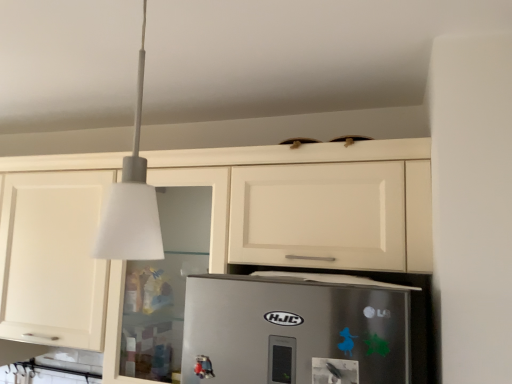
Describe the element at coordinates (131, 200) in the screenshot. The height and width of the screenshot is (384, 512). I see `white matte lampshade at upper center` at that location.

Where is `white matte lampshade at upper center`? This screenshot has width=512, height=384. white matte lampshade at upper center is located at coordinates (131, 200).

Describe the element at coordinates (300, 163) in the screenshot. I see `white matte cabinet at upper center` at that location.

The width and height of the screenshot is (512, 384). Identify the location of white matte cabinet at upper center. (300, 163).

Locate an element on the screen. The image size is (512, 384). white matte lampshade at upper center is located at coordinates (131, 200).

Is white matte lampshade at upper center to the left or to the right of white matte cabinet at upper center in the image?

In the image, white matte lampshade at upper center appears on the right side of white matte cabinet at upper center.

Which is in front, white matte lampshade at upper center or white matte cabinet at upper center?

Positioned in front is white matte lampshade at upper center.

Between point (126, 166) and point (429, 237), which one is positioned in front?

The point (126, 166) is closer.

From the image's perspective, is white matte lampshade at upper center on white matte cabinet at upper center?

Yes, from the image's perspective, white matte lampshade at upper center is over white matte cabinet at upper center.

From a real-world perspective, between white matte lampshade at upper center and white matte cabinet at upper center, who is vertically lower?

white matte cabinet at upper center is physically lower.

Which of these two, white matte lampshade at upper center or white matte cabinet at upper center, is wider?

With larger width is white matte cabinet at upper center.

Considering the relative sizes of white matte lampshade at upper center and white matte cabinet at upper center in the image provided, is white matte lampshade at upper center taller than white matte cabinet at upper center?

Incorrect, the height of white matte lampshade at upper center is not larger of that of white matte cabinet at upper center.

Can you confirm if white matte lampshade at upper center is smaller than white matte cabinet at upper center?

Correct, white matte lampshade at upper center occupies less space than white matte cabinet at upper center.

Is white matte lampshade at upper center positioned beyond the bounds of white matte cabinet at upper center?

white matte lampshade at upper center lies outside white matte cabinet at upper center's area.

Based on the photo, is white matte lampshade at upper center not close to white matte cabinet at upper center?

white matte lampshade at upper center is near white matte cabinet at upper center, not far away.

Is white matte lampshade at upper center facing towards white matte cabinet at upper center?

No, white matte lampshade at upper center is not facing towards white matte cabinet at upper center.

What's the angular difference between white matte lampshade at upper center and white matte cabinet at upper center's facing directions?

white matte lampshade at upper center and white matte cabinet at upper center are facing 90 degrees away from each other.

You are a GUI agent. You are given a task and a screenshot of the screen. Output one action in this format:
    pyautogui.click(x=<x>, y=<y>)
    Task: Click on the cabinetry located behind the white matte lampshade at upper center
    Image resolution: width=512 pixels, height=384 pixels.
    Given the screenshot: What is the action you would take?
    (300, 163)

Which object is positioned more to the left, white matte cabinet at upper center or white matte lampshade at upper center?

white matte cabinet at upper center is more to the left.

Considering the relative positions of white matte cabinet at upper center and white matte lampshade at upper center in the image provided, is white matte cabinet at upper center in front of white matte lampshade at upper center?

No, white matte cabinet at upper center is further to the viewer.

Does point (236, 155) appear closer or farther from the camera than point (133, 255)?

Point (236, 155).

From the image's perspective, is white matte cabinet at upper center beneath white matte lampshade at upper center?

Yes, from the image's perspective, white matte cabinet at upper center is below white matte lampshade at upper center.

From a real-world perspective, who is located higher, white matte cabinet at upper center or white matte lampshade at upper center?

From a 3D spatial view, white matte lampshade at upper center is above.

Is white matte cabinet at upper center wider or thinner than white matte lampshade at upper center?

Clearly, white matte cabinet at upper center has more width compared to white matte lampshade at upper center.

Between white matte cabinet at upper center and white matte lampshade at upper center, which one has more height?

white matte cabinet at upper center.

Is white matte cabinet at upper center bigger than white matte lampshade at upper center?

Yes.

Would you say white matte cabinet at upper center contains white matte lampshade at upper center?

No, white matte lampshade at upper center is located outside of white matte cabinet at upper center.

Is white matte cabinet at upper center next to white matte lampshade at upper center and touching it?

No.

Is white matte cabinet at upper center turned away from white matte lampshade at upper center?

That's not correct — white matte cabinet at upper center is not looking away from white matte lampshade at upper center.

How much distance is there between white matte cabinet at upper center and white matte lampshade at upper center?

The distance of white matte cabinet at upper center from white matte lampshade at upper center is 73.85 centimeters.

Locate an element on the screen. The height and width of the screenshot is (384, 512). cabinetry below the white matte lampshade at upper center (from the image's perspective) is located at coordinates (300, 163).

This screenshot has width=512, height=384. Identify the location of cabinetry located behind the white matte lampshade at upper center. (300, 163).

I want to click on cabinetry that is on the left side of white matte lampshade at upper center, so click(x=300, y=163).